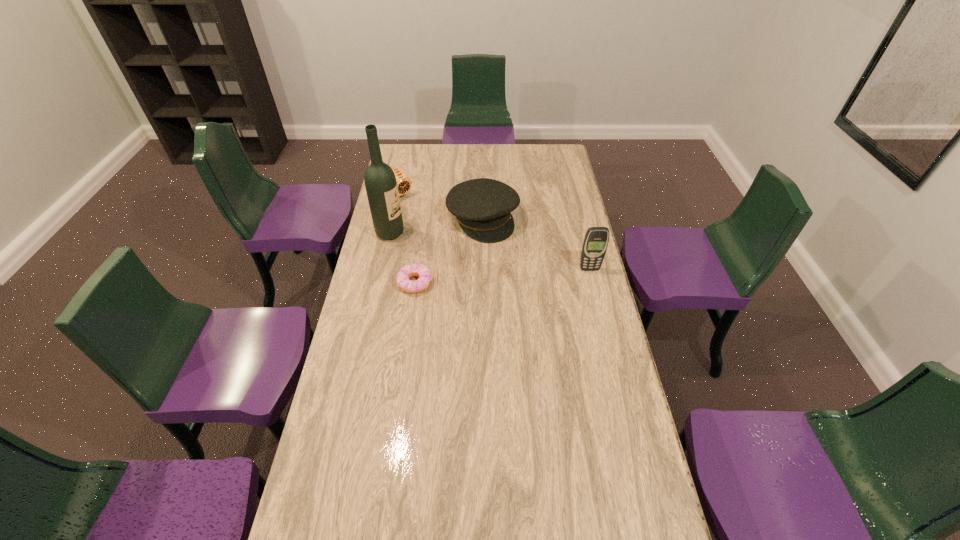
Where is `object positioned at the right edge`? Image resolution: width=960 pixels, height=540 pixels. object positioned at the right edge is located at coordinates (596, 239).

Image resolution: width=960 pixels, height=540 pixels. Find the location of `vacant space at the far edge of the desktop`. vacant space at the far edge of the desktop is located at coordinates (486, 158).

The image size is (960, 540). I want to click on free spot at the near edge of the desktop, so click(x=485, y=505).

Image resolution: width=960 pixels, height=540 pixels. I want to click on free space at the left edge of the desktop, so point(410,202).

Find the location of a particular element. free region at the right edge of the desktop is located at coordinates [x=591, y=332].

Find the location of a particular element. free space between the beret and the doughnut is located at coordinates (449, 251).

Find the location of `empty space that is in between the shortest object and the cellular telephone`. empty space that is in between the shortest object and the cellular telephone is located at coordinates (502, 276).

The height and width of the screenshot is (540, 960). What are the coordinates of `vacant space that is in between the tallest object and the cellular telephone` in the screenshot? It's located at (490, 251).

What are the coordinates of `free space between the watch and the doughnut` in the screenshot? It's located at (407, 238).

The image size is (960, 540). I want to click on free area in between the fourth shortest object and the doughnut, so click(x=502, y=276).